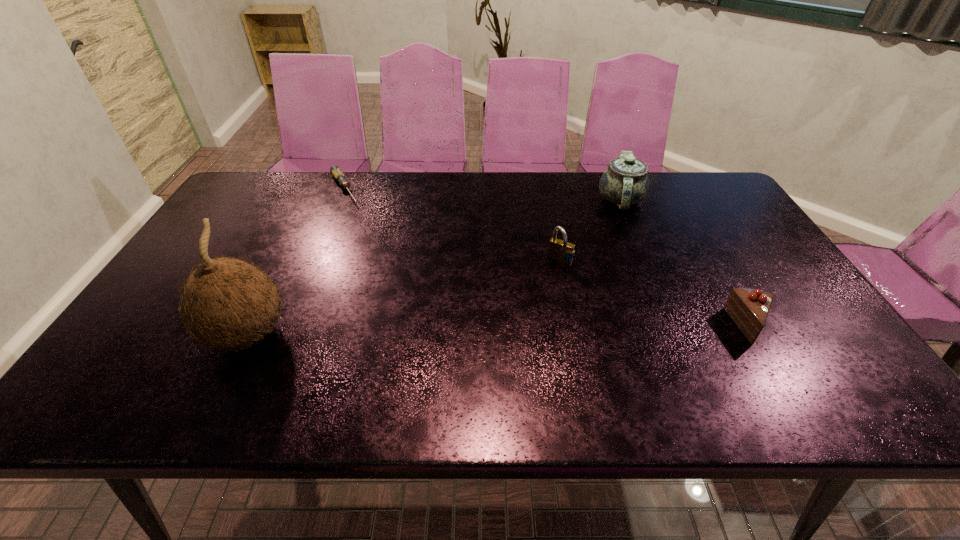
The image size is (960, 540). In order to click on the tallest object in this screenshot , I will do `click(226, 302)`.

Locate an element on the screen. The image size is (960, 540). the fourth tallest object is located at coordinates (748, 308).

Where is `the rightmost object`? Image resolution: width=960 pixels, height=540 pixels. the rightmost object is located at coordinates (748, 308).

I want to click on screwdriver, so 335,170.

The height and width of the screenshot is (540, 960). Identify the location of padlock. (561, 251).

Find the location of a particular element. the third object from left to right is located at coordinates (561, 251).

I want to click on the fourth shortest object, so click(625, 182).

I want to click on the second object from right to left, so click(x=625, y=182).

The image size is (960, 540). Identify the location of vacant space situated 0.110m on the surface of the tallest object. (x=339, y=335).

Locate an element on the screen. This screenshot has height=540, width=960. free space located on the left of the chocolate cake is located at coordinates (693, 326).